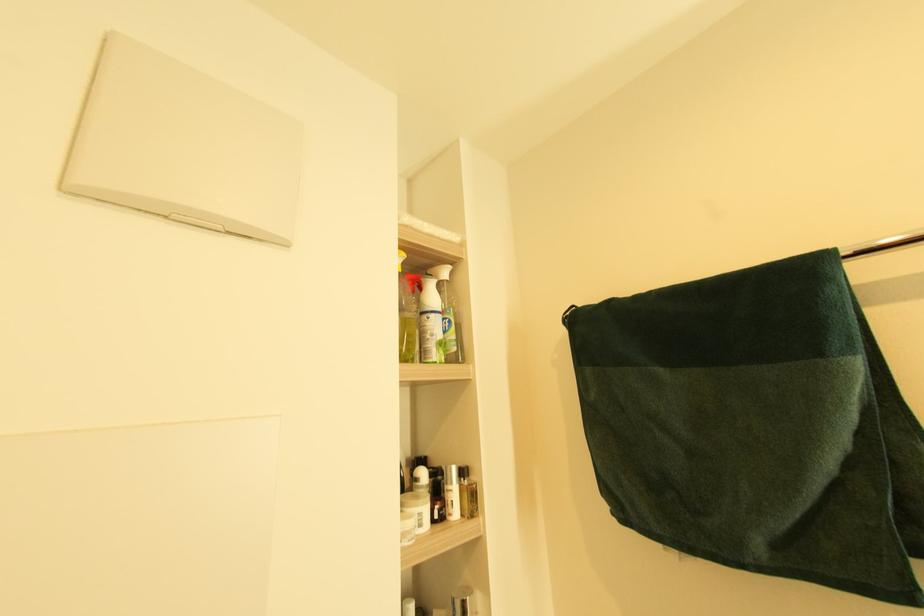
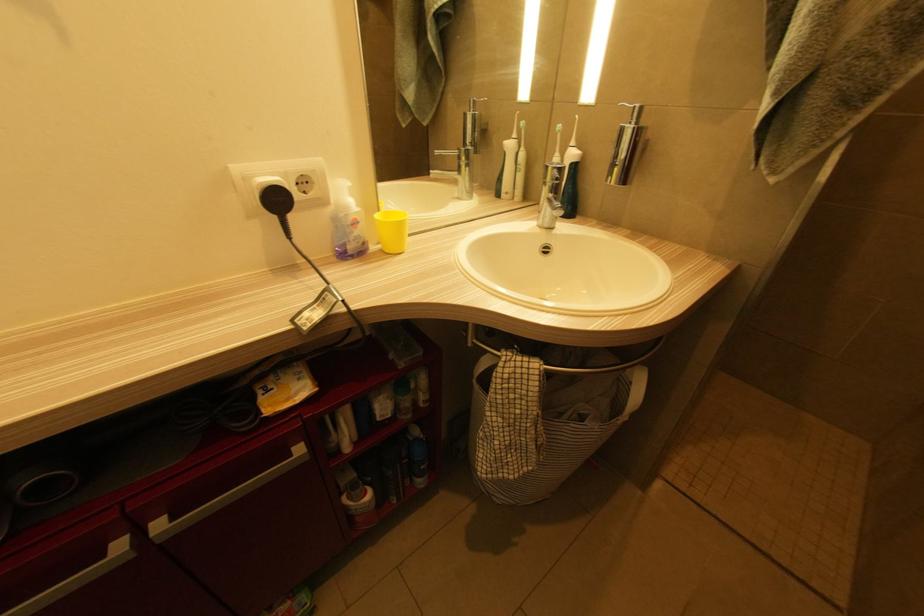
The images are taken continuously from a first-person perspective. In which direction is your viewpoint rotating?

The camera's rotation is toward right-down.